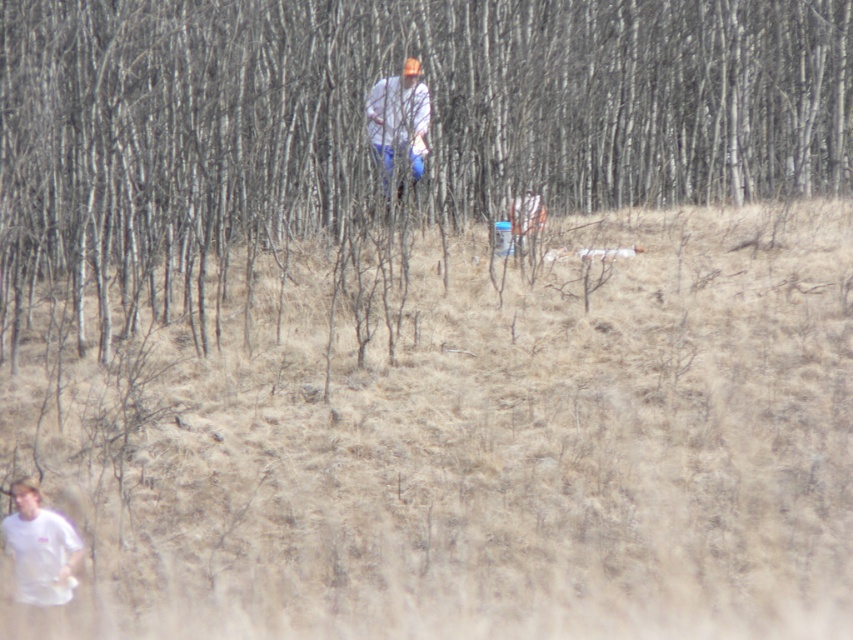
Question: Does brown grass at center lie behind white matte t-shirt at lower left?

Choices:
 (A) no
 (B) yes

Answer: (A)

Question: Does brown grass at center appear on the right side of white matte shirt at center?

Choices:
 (A) no
 (B) yes

Answer: (B)

Question: Which object appears closest to the camera in this image?

Choices:
 (A) brown bark tree at center
 (B) white matte t-shirt at lower left

Answer: (B)

Question: Considering the real-world distances, which object is farthest from the white matte shirt at center?

Choices:
 (A) white matte t-shirt at lower left
 (B) brown grass at center

Answer: (A)

Question: Is brown bark tree at center wider than white matte t-shirt at lower left?

Choices:
 (A) yes
 (B) no

Answer: (A)

Question: Among these objects, which one is nearest to the camera?

Choices:
 (A) brown grass at center
 (B) brown bark tree at center
 (C) white matte t-shirt at lower left

Answer: (A)